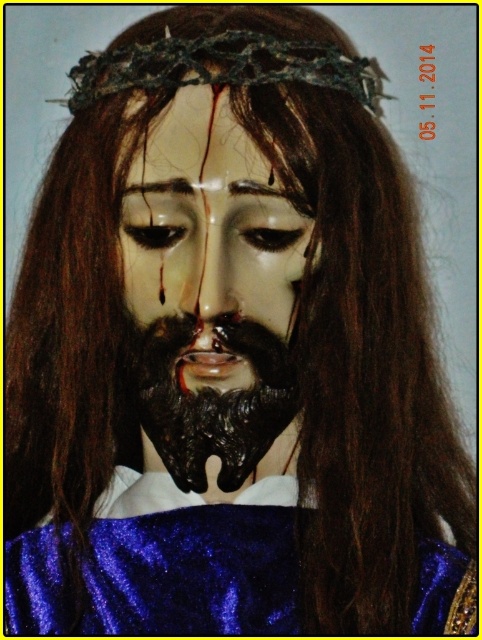
Consider the image. You are an artist trying to sketch the scene. You want to ensure the blue glittery robe at center and the porcelain face at center are proportionally accurate. Which object should you draw wider?

The blue glittery robe at center should be drawn wider since its width surpasses that of the porcelain face at center.

You are an art restorer examining the image. You need to clean the blue glittery robe at center and the porcelain face at center. Which object should you clean first if you want to avoid getting the robe wet, considering their positions?

The porcelain face at center is behind the blue glittery robe at center, so you should clean the porcelain face at center first to avoid getting the robe wet.

You are an artist trying to paint this scene. You need to ensure that the blue glittery robe at center and the dark green spiky crown at upper center are proportionally accurate. Which object should you make wider in your painting?

The blue glittery robe at center should be made wider in the painting since its width is larger than the dark green spiky crown at upper center according to the description.